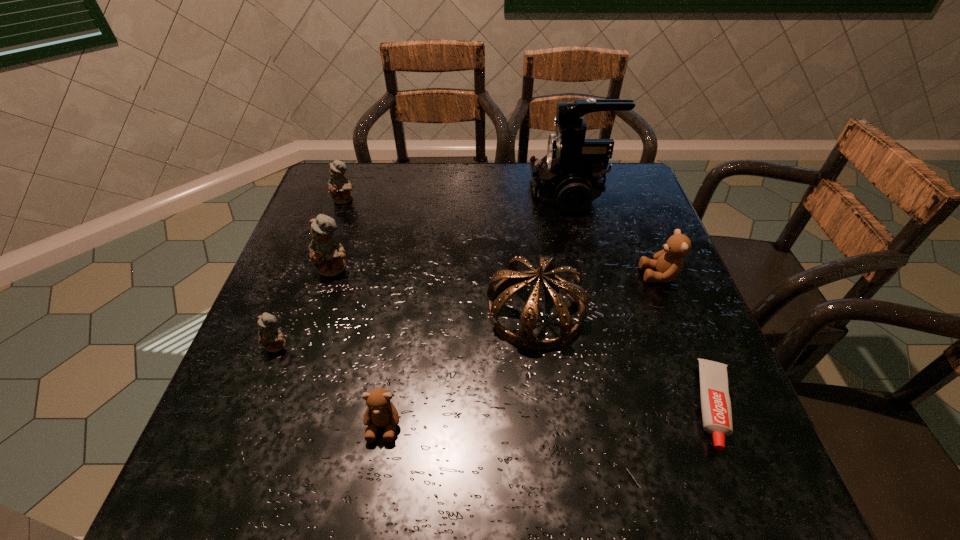
I want to click on blank space located on the front-facing side of the bigger brown teddy bear, so click(573, 275).

This screenshot has width=960, height=540. Find the location of `free location located 0.130m on the front-facing side of the farthest teddy bear`. free location located 0.130m on the front-facing side of the farthest teddy bear is located at coordinates (331, 235).

The image size is (960, 540). What are the coordinates of `blank area located 0.180m on the front-facing side of the second nearest teddy bear` in the screenshot? It's located at (241, 441).

Where is `vacant space located 0.050m on the front-facing side of the fourth object from left to right`? This screenshot has width=960, height=540. vacant space located 0.050m on the front-facing side of the fourth object from left to right is located at coordinates (375, 474).

The width and height of the screenshot is (960, 540). I want to click on vacant area situated on the back of the toothpaste, so click(x=675, y=306).

Locate an element on the screen. This screenshot has height=540, width=960. camcorder that is at the far edge is located at coordinates (571, 175).

What are the coordinates of `teddy bear present at the far edge` in the screenshot? It's located at (339, 188).

Locate an element on the screen. The image size is (960, 540). object that is at the near edge is located at coordinates (716, 409).

Where is `camcorder that is positioned at the right edge`? This screenshot has height=540, width=960. camcorder that is positioned at the right edge is located at coordinates (571, 175).

Find the location of a particular element. This screenshot has width=960, height=540. teddy bear that is at the right edge is located at coordinates (668, 263).